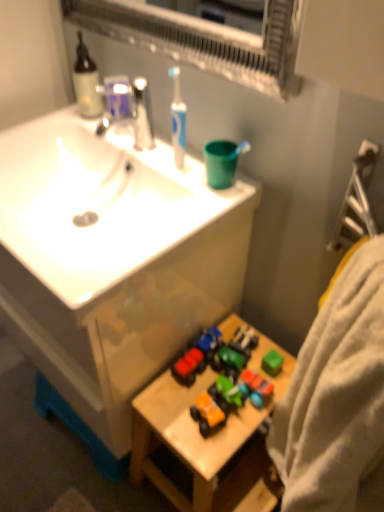
This screenshot has width=384, height=512. In order to click on vacant space positioned to the left of green matte toy car at lower center, acting as the 4th toy starting from the left in this screenshot , I will do `click(183, 401)`.